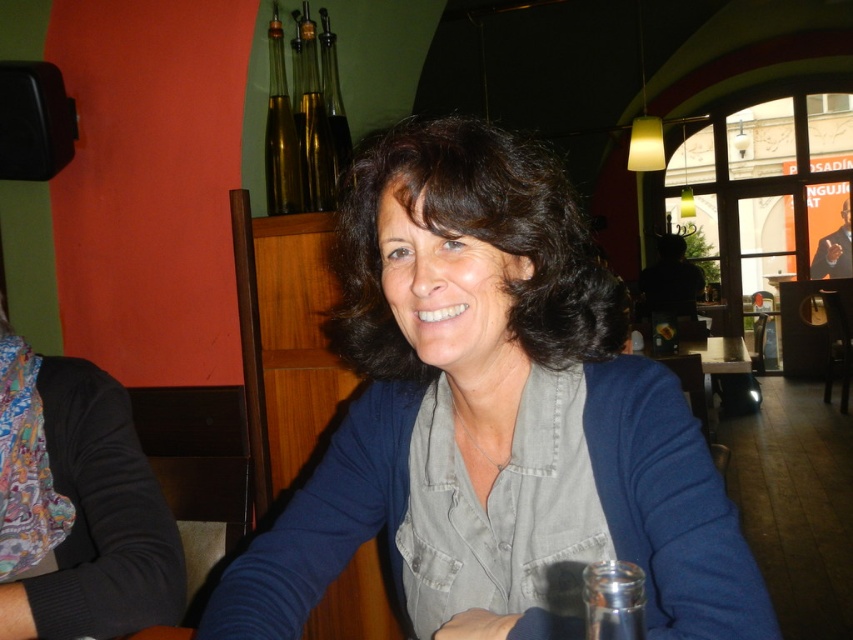
Question: From the image, what is the correct spatial relationship of brown glass bottle at upper left in relation to white glossy table at center?

Choices:
 (A) right
 (B) left

Answer: (B)

Question: Among these objects, which one is nearest to the camera?

Choices:
 (A) gold glass bottles at upper center
 (B) brown glass bottle at upper left

Answer: (B)

Question: Which object is positioned closest to the brown glass bottle at upper left?

Choices:
 (A) matte blue sweater at center
 (B) printed fabric scarf at left

Answer: (B)

Question: Does matte blue sweater at center appear on the left side of gold glass bottles at upper center?

Choices:
 (A) no
 (B) yes

Answer: (A)

Question: Is matte blue sweater at center thinner than transparent glass at lower right?

Choices:
 (A) no
 (B) yes

Answer: (A)

Question: Based on their relative distances, which object is nearer to the matte blue sweater at center?

Choices:
 (A) transparent glass at lower right
 (B) printed fabric scarf at left
 (C) white glossy table at center

Answer: (A)